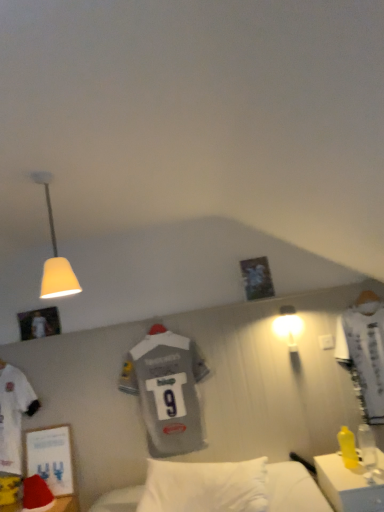
Question: Is the position of matte white lampshade at upper left, the second lamp positioned from the right, less distant than that of yellow plastic desk at lower right?

Choices:
 (A) no
 (B) yes

Answer: (B)

Question: Are matte white lampshade at upper left, marked as the 2th lamp in a back-to-front arrangement, and yellow plastic desk at lower right beside each other?

Choices:
 (A) yes
 (B) no

Answer: (B)

Question: Is yellow plastic desk at lower right a part of matte white lampshade at upper left, marked as the 1th lamp in a front-to-back arrangement?

Choices:
 (A) no
 (B) yes

Answer: (A)

Question: Is matte white lampshade at upper left, marked as the 2th lamp in a back-to-front arrangement, not within yellow plastic desk at lower right?

Choices:
 (A) yes
 (B) no

Answer: (A)

Question: Is there a large distance between matte white lampshade at upper left, marked as the 1th lamp in a front-to-back arrangement, and yellow plastic desk at lower right?

Choices:
 (A) yes
 (B) no

Answer: (A)

Question: Does matte white lampshade at upper left, which is the 1th lamp from top to bottom, have a lesser width compared to yellow plastic desk at lower right?

Choices:
 (A) yes
 (B) no

Answer: (A)

Question: Is matte white bulb at upper right, the 2th lamp positioned from the left, outside matte white lampshade at upper left, marked as the 2th lamp in a back-to-front arrangement?

Choices:
 (A) no
 (B) yes

Answer: (B)

Question: From a real-world perspective, is matte white bulb at upper right, the 2th lamp in the top-to-bottom sequence, positioned over matte white lampshade at upper left, marked as the 1th lamp in a front-to-back arrangement, based on gravity?

Choices:
 (A) yes
 (B) no

Answer: (B)

Question: Considering the relative positions of matte white bulb at upper right, the 1th lamp ordered from the bottom, and matte white lampshade at upper left, marked as the 2th lamp in a back-to-front arrangement, in the image provided, is matte white bulb at upper right, the 1th lamp ordered from the bottom, behind matte white lampshade at upper left, marked as the 2th lamp in a back-to-front arrangement,?

Choices:
 (A) no
 (B) yes

Answer: (B)

Question: Would you say matte white lampshade at upper left, the second lamp positioned from the right, is part of matte white bulb at upper right, positioned as the second lamp in front-to-back order,'s contents?

Choices:
 (A) no
 (B) yes

Answer: (A)

Question: Is matte white bulb at upper right, the 2th lamp in the top-to-bottom sequence, oriented towards matte white lampshade at upper left, marked as the 2th lamp in a back-to-front arrangement?

Choices:
 (A) no
 (B) yes

Answer: (A)

Question: Is matte white bulb at upper right, which is the 1th lamp from back to front, wider than matte white lampshade at upper left, which is the 1th lamp from top to bottom?

Choices:
 (A) yes
 (B) no

Answer: (B)

Question: Is gray jersey at center at the right side of matte white bulb at upper right, the 2th lamp positioned from the left?

Choices:
 (A) yes
 (B) no

Answer: (B)